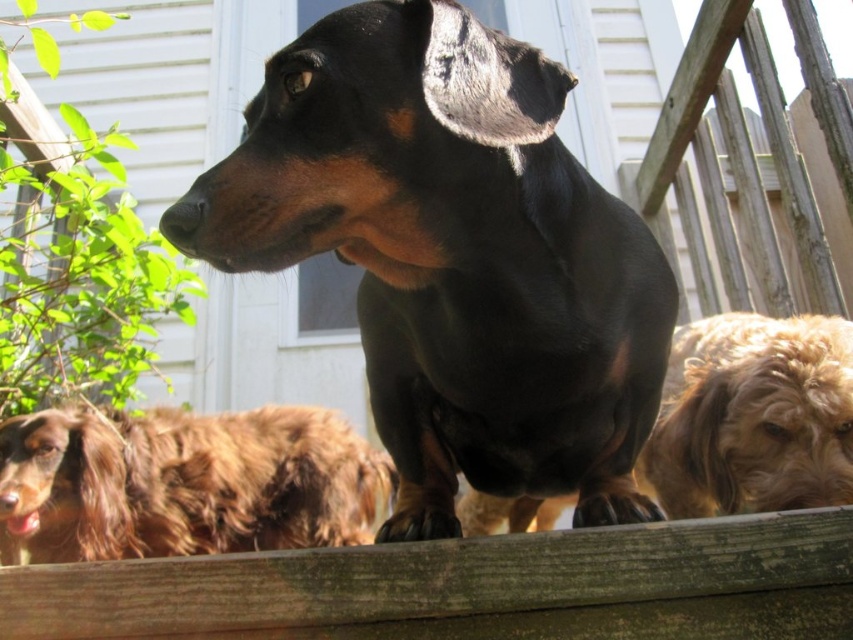
Question: Is black shiny dog at center to the right of golden brown fur at right from the viewer's perspective?

Choices:
 (A) no
 (B) yes

Answer: (A)

Question: Is black shiny dog at center positioned before brown shaggy dog at lower left?

Choices:
 (A) yes
 (B) no

Answer: (A)

Question: Among these objects, which one is nearest to the camera?

Choices:
 (A) golden brown fur at right
 (B) brown shaggy dog at lower left
 (C) black shiny dog at center

Answer: (C)

Question: Which object is farther from the camera taking this photo?

Choices:
 (A) brown shaggy dog at lower left
 (B) black shiny dog at center
 (C) golden brown fur at right

Answer: (A)

Question: Which object is positioned closest to the golden brown fur at right?

Choices:
 (A) black shiny dog at center
 (B) brown shaggy dog at lower left

Answer: (A)

Question: Can you confirm if black shiny dog at center is thinner than brown shaggy dog at lower left?

Choices:
 (A) yes
 (B) no

Answer: (A)